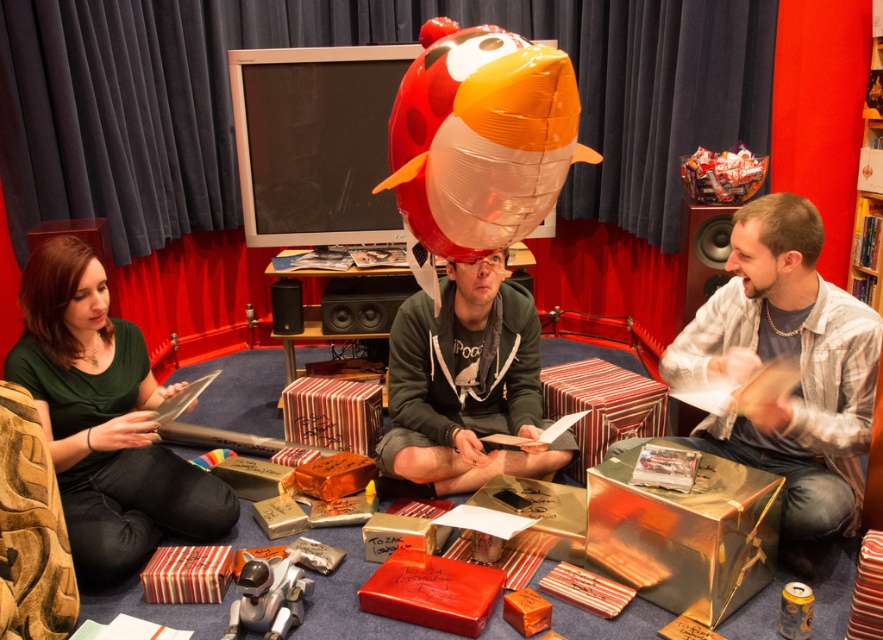
Question: Can you confirm if matte black speaker at right is positioned above matte black speaker at center?

Choices:
 (A) yes
 (B) no

Answer: (A)

Question: Which of the following is the closest to the observer?

Choices:
 (A) green matte shirt at left
 (B) matte black speaker at center
 (C) matte gray shirt at center
 (D) inflatable orange fish at center

Answer: (D)

Question: Based on their relative distances, which object is nearer to the inflatable orange fish at center?

Choices:
 (A) matte black speaker at center
 (B) matte green hoodie at center

Answer: (B)

Question: Observing the image, what is the correct spatial positioning of green matte shirt at left in reference to metallic silver robot at lower center?

Choices:
 (A) left
 (B) right

Answer: (A)

Question: Is black matte speaker at center in front of matte black speaker at center?

Choices:
 (A) yes
 (B) no

Answer: (A)

Question: Estimate the real-world distances between objects in this image. Which object is closer to the inflatable orange fish at center?

Choices:
 (A) matte gray shirt at center
 (B) metallic silver robot at lower center
 (C) matte black speaker at right

Answer: (A)